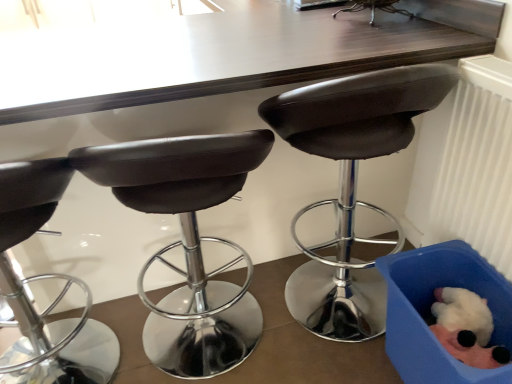
Question: Based on their sizes in the image, would you say blue fabric box at lower right is bigger or smaller than matte black stool at center, the second chair from the right?

Choices:
 (A) big
 (B) small

Answer: (B)

Question: In the image, is blue fabric box at lower right positioned in front of or behind matte black stool at center, the second chair from the right?

Choices:
 (A) front
 (B) behind

Answer: (B)

Question: Which of these objects is positioned closest to the matte black stool at center, placed as the 3th chair when sorted from right to left?

Choices:
 (A) blue fabric box at lower right
 (B) matte black stool at center, the third chair in the left-to-right sequence
 (C) metallic silver stool at center, which is the fourth chair from left to right
 (D) white plastic radiator at right
 (E) fluffy white plush toy at lower right

Answer: (B)

Question: Based on their relative distances, which object is nearer to the fluffy white plush toy at lower right?

Choices:
 (A) matte black stool at left, which is the 4th chair in right-to-left order
 (B) metallic silver stool at center, which is the fourth chair from left to right
 (C) matte black stool at center, the third chair in the left-to-right sequence
 (D) blue fabric box at lower right
 (E) matte black stool at center, the second chair from the left

Answer: (D)